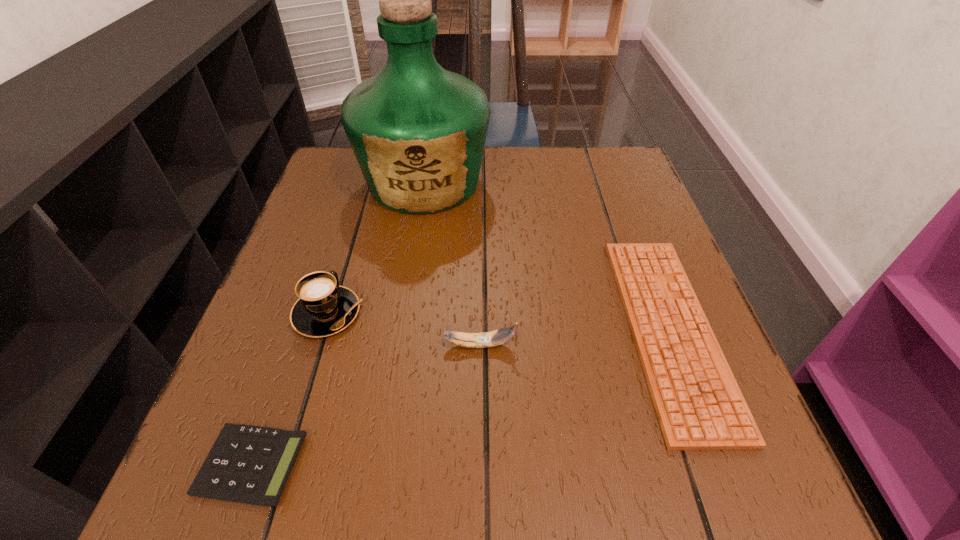
Locate an element on the screen. vacant space in between the calculator and the cappuccino is located at coordinates (290, 389).

The image size is (960, 540). Find the location of `free area in between the banana and the cappuccino`. free area in between the banana and the cappuccino is located at coordinates tap(403, 329).

You are a GUI agent. You are given a task and a screenshot of the screen. Output one action in this format:
    pyautogui.click(x=<x>, y=<y>)
    Task: Click on the blank region between the computer keyboard and the cappuccino
    
    Given the screenshot: What is the action you would take?
    [498, 321]

Image resolution: width=960 pixels, height=540 pixels. Find the location of `unoccupied position between the banana and the rightmost object`. unoccupied position between the banana and the rightmost object is located at coordinates (574, 338).

This screenshot has height=540, width=960. Find the location of `vacant area that lies between the cappuccino and the computer keyboard`. vacant area that lies between the cappuccino and the computer keyboard is located at coordinates (498, 321).

Image resolution: width=960 pixels, height=540 pixels. In order to click on free space between the rightmost object and the farthest object in this screenshot , I will do `click(546, 256)`.

I want to click on free spot between the calculator and the banana, so click(x=366, y=404).

Identify which object is located as the second nearest to the cappuccino. Please provide its 2D coordinates. Your answer should be formatted as a tuple, i.e. [(x, y)], where the tuple contains the x and y coordinates of a point satisfying the conditions above.

[(247, 464)]

Find the location of a particular element. The height and width of the screenshot is (540, 960). object that is the third closest to the calculator is located at coordinates (418, 131).

What are the coordinates of `blank area in the image that satisfies the following two spatial constraints: 1. on the label side of the rightmost object; 2. on the right side of the tallest object` in the screenshot? It's located at (401, 330).